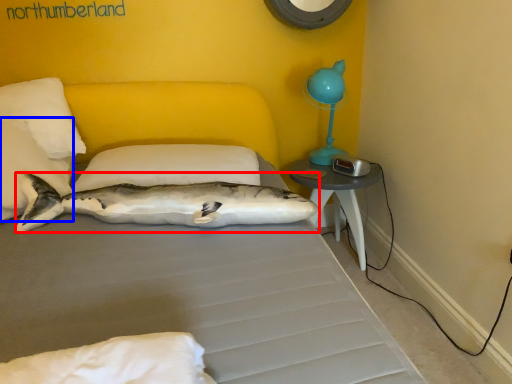
Question: Among these objects, which one is nearest to the camera, shark (highlighted by a red box) or pillow (highlighted by a blue box)?

Choices:
 (A) shark
 (B) pillow

Answer: (A)